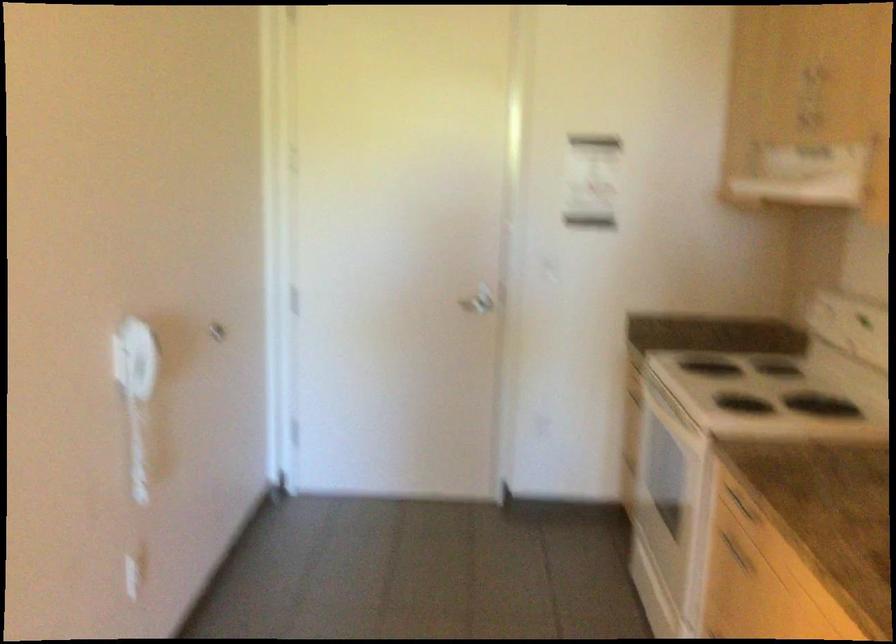
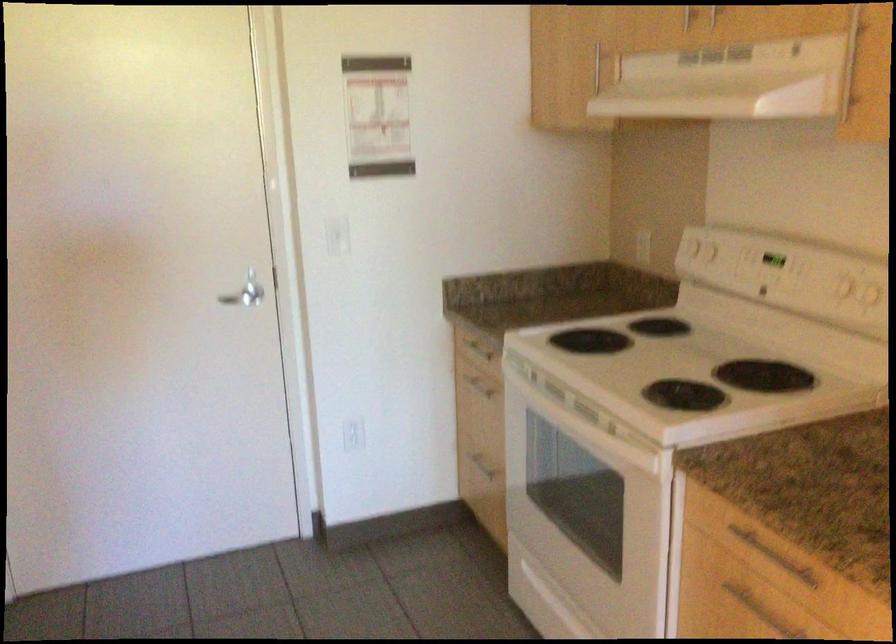
Find the pixel in the second image that matches (x=768, y=392) in the first image.

(686, 365)